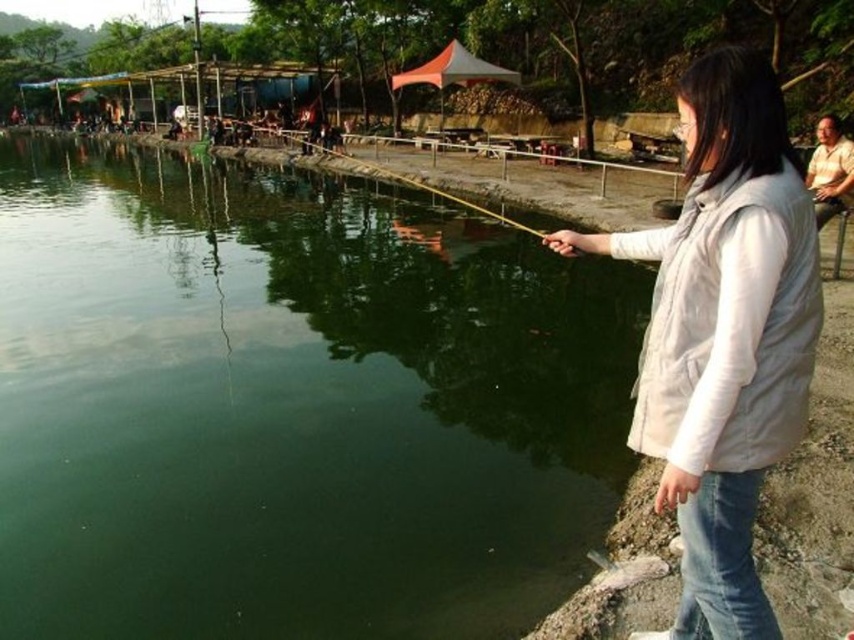
Question: Among these objects, which one is nearest to the camera?

Choices:
 (A) white matte vest at right
 (B) green smooth water at center

Answer: (A)

Question: Is green smooth water at center smaller than white matte vest at right?

Choices:
 (A) no
 (B) yes

Answer: (A)

Question: Which point is closer to the camera?

Choices:
 (A) green smooth water at center
 (B) white matte vest at right

Answer: (B)

Question: Does green smooth water at center appear over white matte vest at right?

Choices:
 (A) no
 (B) yes

Answer: (B)

Question: Can you confirm if green smooth water at center is positioned above white matte vest at right?

Choices:
 (A) yes
 (B) no

Answer: (A)